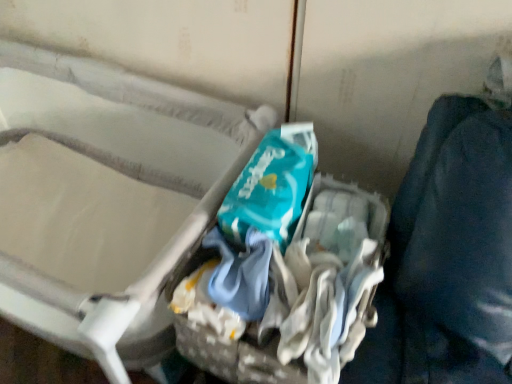
In the scene shown: Measure the distance between point (x=146, y=89) and camera.

The distance of point (x=146, y=89) from camera is 3.59 feet.

This screenshot has width=512, height=384. Describe the element at coordinates (105, 199) in the screenshot. I see `white fabric crib at upper left` at that location.

I want to click on white fabric crib at upper left, so click(105, 199).

Locate an element on the screen. The image size is (512, 384). teal fabric bag at center is located at coordinates (288, 277).

What do you see at coordinates (288, 277) in the screenshot?
I see `teal fabric bag at center` at bounding box center [288, 277].

Where is `white fabric crib at upper left`? The width and height of the screenshot is (512, 384). white fabric crib at upper left is located at coordinates (105, 199).

Which is more to the right, white fabric crib at upper left or teal fabric bag at center?

From the viewer's perspective, teal fabric bag at center appears more on the right side.

Is white fabric crib at upper left further to the viewer compared to teal fabric bag at center?

No, it is not.

Is point (10, 116) closer or farther from the camera than point (231, 302)?

Point (10, 116).

From the image's perspective, which one is positioned lower, white fabric crib at upper left or teal fabric bag at center?

From the image's view, teal fabric bag at center is below.

Consider the image. From a real-world perspective, is white fabric crib at upper left below teal fabric bag at center?

Yes, from a real-world perspective, white fabric crib at upper left is beneath teal fabric bag at center.

Which object is thinner, white fabric crib at upper left or teal fabric bag at center?

teal fabric bag at center is thinner.

Is white fabric crib at upper left taller or shorter than teal fabric bag at center?

In the image, white fabric crib at upper left appears to be taller than teal fabric bag at center.

Who is bigger, white fabric crib at upper left or teal fabric bag at center?

With larger size is white fabric crib at upper left.

Does white fabric crib at upper left contain teal fabric bag at center?

No, teal fabric bag at center is not inside white fabric crib at upper left.

Is white fabric crib at upper left directly adjacent to teal fabric bag at center?

white fabric crib at upper left is not next to teal fabric bag at center, and they're not touching.

Is white fabric crib at upper left oriented away from teal fabric bag at center?

No, white fabric crib at upper left is not facing away from teal fabric bag at center.

Can you tell me how much white fabric crib at upper left and teal fabric bag at center differ in facing direction?

0.56 degrees.

How far apart are white fabric crib at upper left and teal fabric bag at center?

A distance of 13.51 inches exists between white fabric crib at upper left and teal fabric bag at center.

Find the location of a particular element. furniture that is in front of the teal fabric bag at center is located at coordinates (105, 199).

Is teal fabric bag at center to the left of white fabric crib at upper left from the viewer's perspective?

No, teal fabric bag at center is not to the left of white fabric crib at upper left.

Which is behind, teal fabric bag at center or white fabric crib at upper left?

teal fabric bag at center is behind.

Does point (200, 346) lie in front of point (67, 348)?

Yes, it is in front of point (67, 348).

From the image's perspective, who appears lower, teal fabric bag at center or white fabric crib at upper left?

teal fabric bag at center is shown below in the image.

From a real-world perspective, is teal fabric bag at center located beneath white fabric crib at upper left?

No, from a real-world perspective, teal fabric bag at center is not below white fabric crib at upper left.

Which of these two, teal fabric bag at center or white fabric crib at upper left, is wider?

Wider between the two is white fabric crib at upper left.

Which of these two, teal fabric bag at center or white fabric crib at upper left, stands shorter?

teal fabric bag at center.

Considering the sizes of objects teal fabric bag at center and white fabric crib at upper left in the image provided, who is bigger, teal fabric bag at center or white fabric crib at upper left?

white fabric crib at upper left.

Choose the correct answer: Is teal fabric bag at center inside white fabric crib at upper left or outside it?

teal fabric bag at center is spatially situated outside white fabric crib at upper left.

Is teal fabric bag at center next to white fabric crib at upper left and touching it?

No.

Is teal fabric bag at center aimed at white fabric crib at upper left?

No, teal fabric bag at center does not turn towards white fabric crib at upper left.

How far apart are teal fabric bag at center and white fabric crib at upper left?

A distance of 13.51 inches exists between teal fabric bag at center and white fabric crib at upper left.

The height and width of the screenshot is (384, 512). Identify the location of garbage lying on the right of white fabric crib at upper left. (288, 277).

I want to click on furniture in front of the teal fabric bag at center, so click(x=105, y=199).

Identify the location of furniture located underneath the teal fabric bag at center (from a real-world perspective). The width and height of the screenshot is (512, 384). (105, 199).